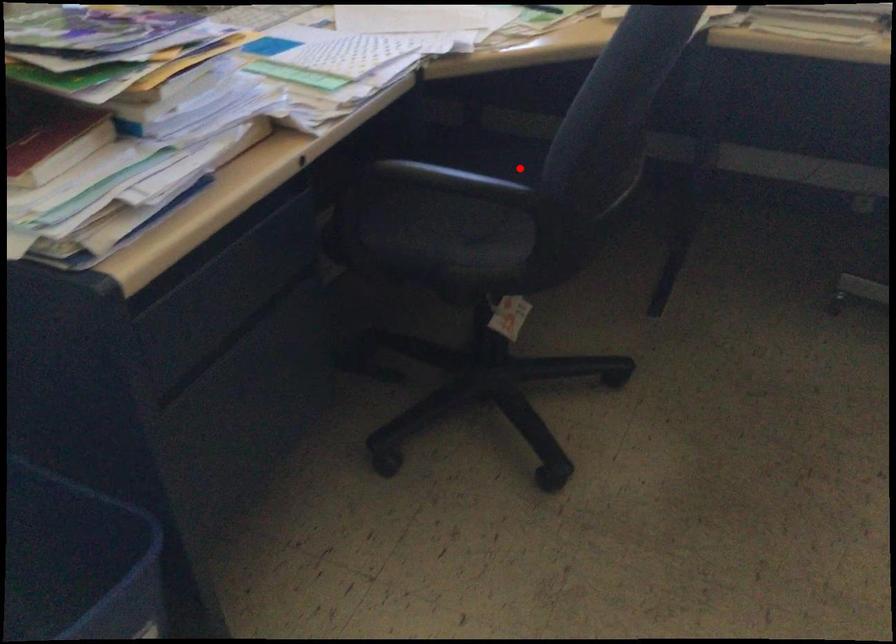
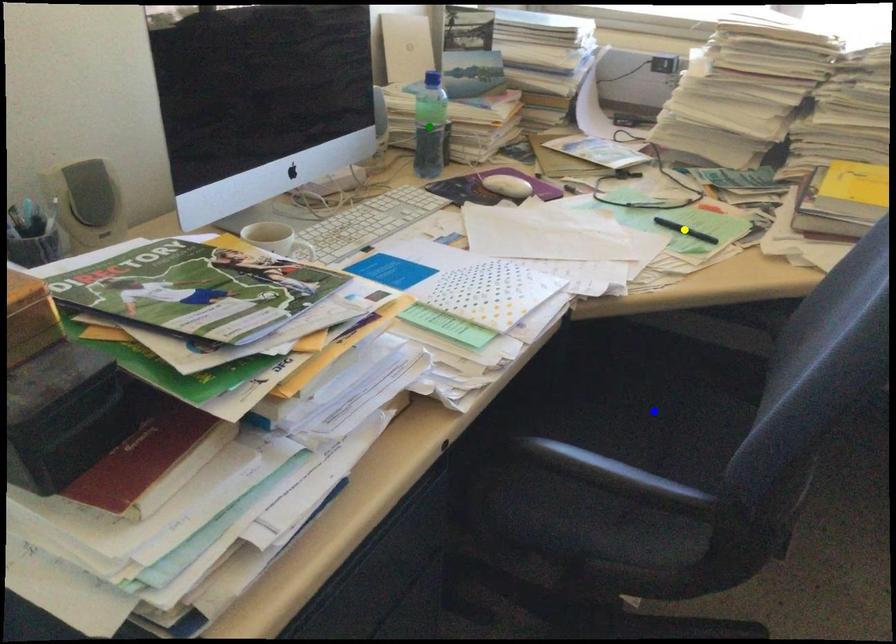
Question: I am providing you with two images of the same scene from different viewpoints. A red point is marked on the first image. You are given multiple points on the second image. Which spot in image 2 lines up with the point in image 1?

Choices:
 (A) blue point
 (B) yellow point
 (C) green point

Answer: (A)